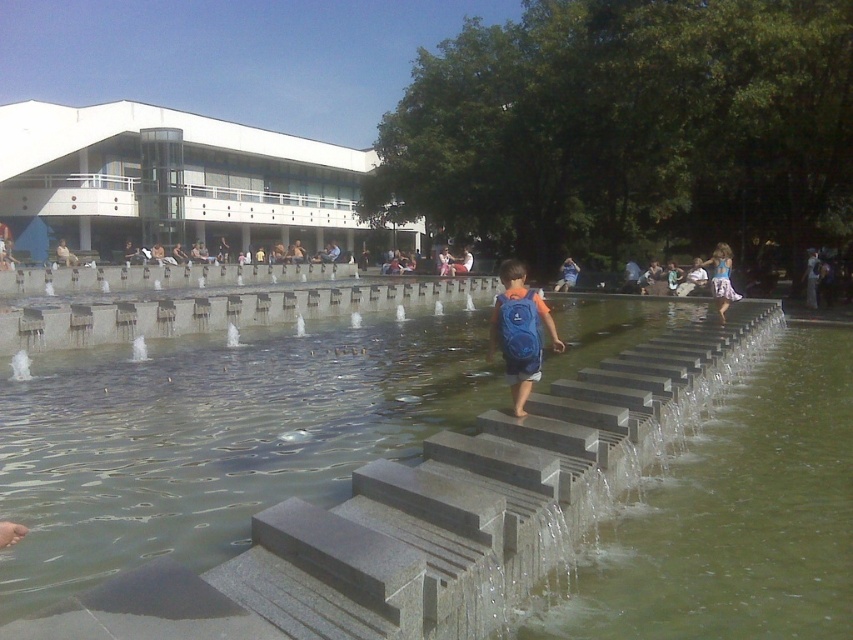
Is the position of dark blue backpack at center more distant than that of light brown wooden bench at center?

No, dark blue backpack at center is in front of light brown wooden bench at center.

Does dark blue backpack at center appear over light brown wooden bench at center?

Incorrect, dark blue backpack at center is not positioned above light brown wooden bench at center.

Is point (816, 280) closer to viewer compared to point (64, 259)?

Yes, point (816, 280) is in front of point (64, 259).

Locate an element on the screen. dark blue backpack at center is located at coordinates (811, 276).

Between blue fabric backpack at center and blue backpack at center, which one is positioned higher?

Positioned higher is blue backpack at center.

Can you confirm if blue fabric backpack at center is positioned to the left of blue backpack at center?

Yes, blue fabric backpack at center is to the left of blue backpack at center.

This screenshot has width=853, height=640. In order to click on blue fabric backpack at center in this screenshot , I will do (x=519, y=323).

Based on the photo, is greenish concrete water at center in front of light brown wooden bench at center?

Yes, it is in front of light brown wooden bench at center.

Does greenish concrete water at center appear on the right side of light brown wooden bench at center?

Correct, you'll find greenish concrete water at center to the right of light brown wooden bench at center.

Who is more forward, (764, 563) or (67, 246)?

Point (764, 563) is in front.

The height and width of the screenshot is (640, 853). In order to click on greenish concrete water at center in this screenshot , I will do `click(717, 512)`.